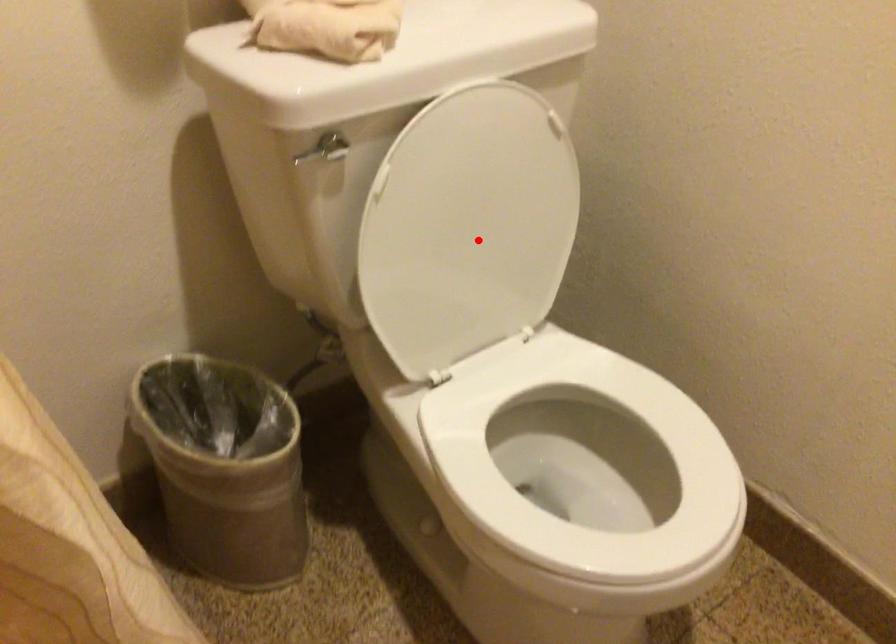
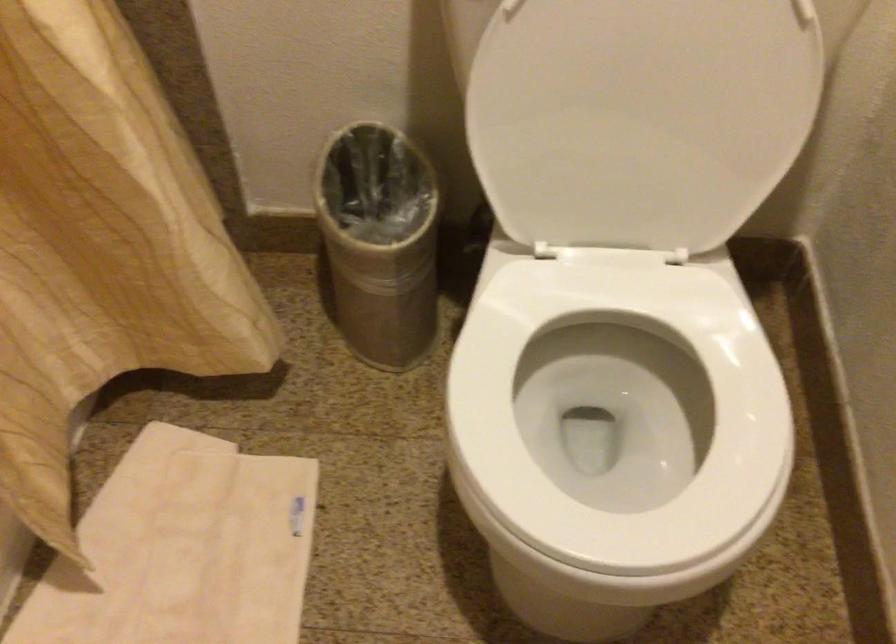
Question: I am providing you with two images of the same scene from different viewpoints. Given a red point in image1, look at the same physical point in image2. Is it:

Choices:
 (A) Closer to the viewpoint
 (B) Farther from the viewpoint

Answer: (A)